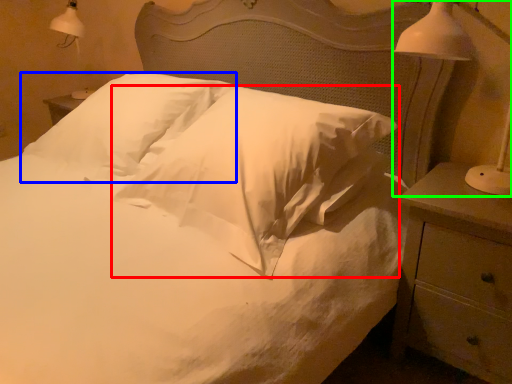
Question: Which object is the closest to the pillow (highlighted by a red box)? Choose among these: pillow (highlighted by a blue box) or bedside lamp (highlighted by a green box).

Choices:
 (A) pillow
 (B) bedside lamp

Answer: (A)